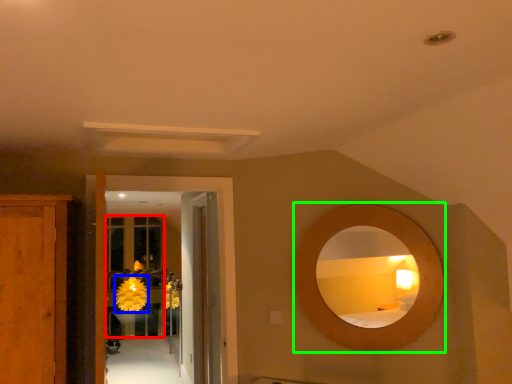
Question: Which object is positioned farthest from glass door (highlighted by a red box)? Select from flower (highlighted by a blue box) and mirror (highlighted by a green box).

Choices:
 (A) flower
 (B) mirror

Answer: (B)